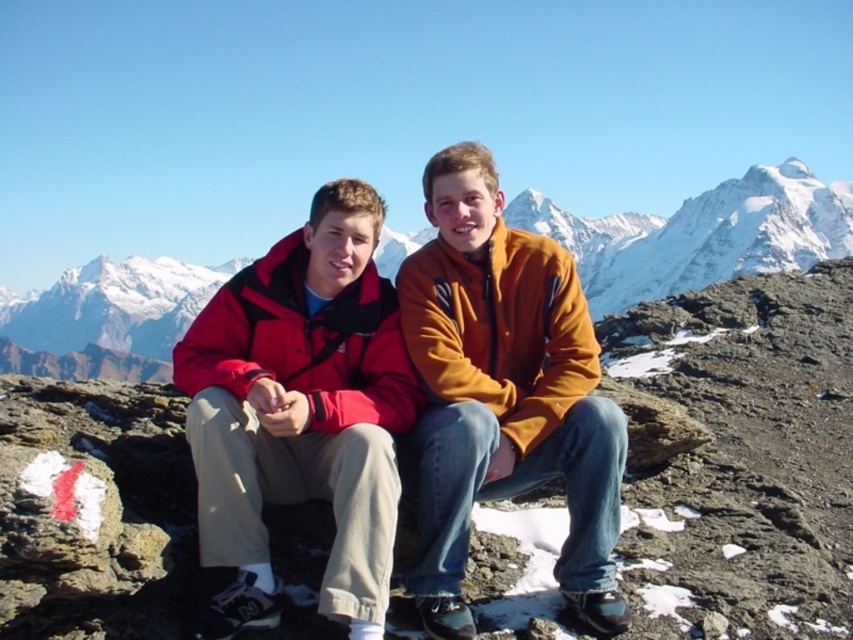
Is matte fleece jackets at center wider than orange fleece jacket at center?

Yes, matte fleece jackets at center is wider than orange fleece jacket at center.

Is matte fleece jackets at center below orange fleece jacket at center?

Indeed, matte fleece jackets at center is positioned under orange fleece jacket at center.

Between point (219, 598) and point (480, 358), which one is positioned in front?

Point (219, 598)

Where is `matte fleece jackets at center`? matte fleece jackets at center is located at coordinates (525, 468).

Is point (496, 202) farther from viewer compared to point (422, 404)?

That is True.

Between point (471, 634) and point (320, 396), which one is positioned behind?

Positioned behind is point (320, 396).

Between point (183, 344) and point (402, 388), which one is positioned in front?

Point (402, 388) is more forward.

Identify the location of matte fleece jackets at center. (525, 468).

From the picture: Can you confirm if matte fleece jackets at center is positioned to the right of snowy mountain at center?

Indeed, matte fleece jackets at center is positioned on the right side of snowy mountain at center.

Between matte fleece jackets at center and snowy mountain at center, which one appears on the left side from the viewer's perspective?

From the viewer's perspective, snowy mountain at center appears more on the left side.

Is point (590, 560) positioned behind point (704, 268)?

No, (590, 560) is in front of (704, 268).

Locate an element on the screen. The height and width of the screenshot is (640, 853). matte fleece jackets at center is located at coordinates (525, 468).